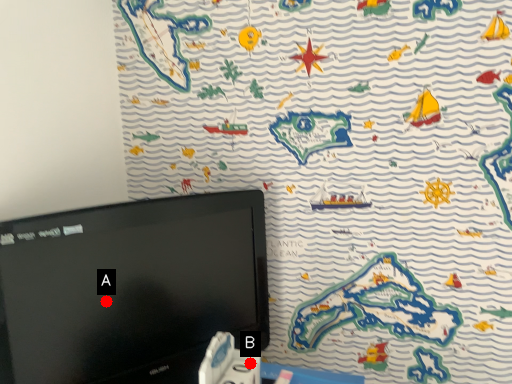
Question: Two points are circled on the image, labeled by A and B beside each circle. Which point appears farthest from the camera in this image?

Choices:
 (A) A is further
 (B) B is further

Answer: (A)